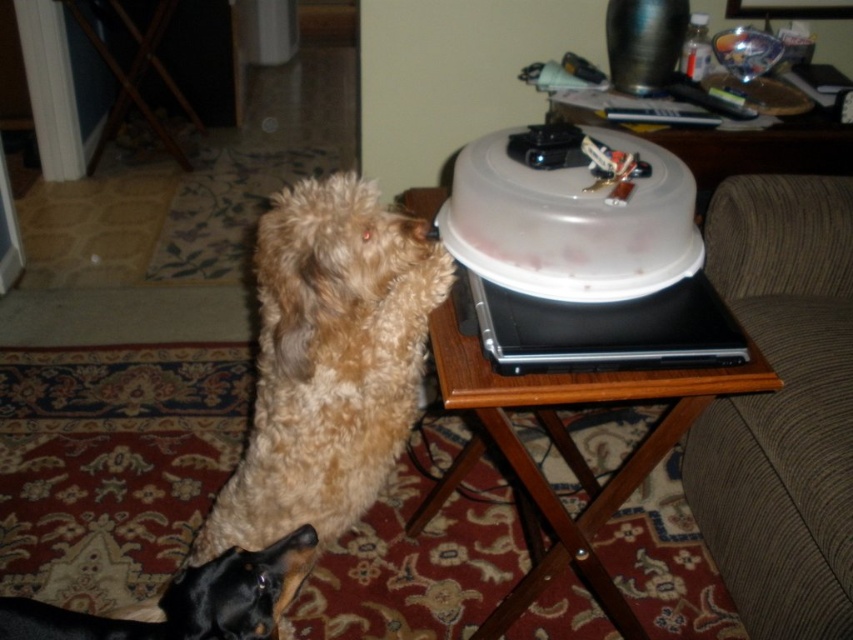
Does fuzzy brown dog at center come in front of wooden side table at upper right?

That is True.

Does fuzzy brown dog at center appear over wooden side table at upper right?

Yes, fuzzy brown dog at center is above wooden side table at upper right.

Is point (321, 358) farther from camera compared to point (595, 573)?

That is False.

Image resolution: width=853 pixels, height=640 pixels. I want to click on fuzzy brown dog at center, so pos(328,362).

Who is higher up, fuzzy brown dog at center or black shiny dog at lower left?

Positioned higher is fuzzy brown dog at center.

Where is `fuzzy brown dog at center`? fuzzy brown dog at center is located at coordinates (328, 362).

Is point (322, 440) farther from camera compared to point (4, 627)?

Yes, it is.

Identify the location of fuzzy brown dog at center. This screenshot has width=853, height=640. (328, 362).

Who is more forward, [560,451] or [138,620]?

Point [138,620] is more forward.

Is point (486, 419) more distant than point (282, 593)?

Yes, point (486, 419) is farther from viewer.

Locate an element on the screen. wooden side table at upper right is located at coordinates (564, 452).